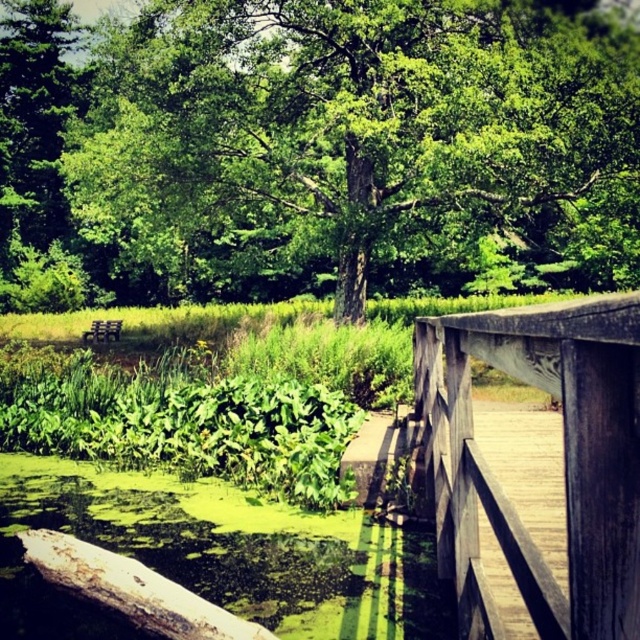
You are standing on the wooden bridge at right. Looking down, you notice a point marked at coordinates (522, 515). Based on the scene description, where is this point located in relation to the wooden bridge at right?

The point at coordinates (522, 515) corresponds to the wooden bridge at right.

You are standing on the wooden bridge and want to take a photo of the green leafy tree at center and the wooden rail at center. Which object should you focus on first if you want to capture both in a single frame without moving the camera? Explain your reasoning based on their sizes.

You should focus on the green leafy tree at center first because it is larger in size than the wooden rail at center, making it more prominent and ensuring it is sharply captured in the frame.